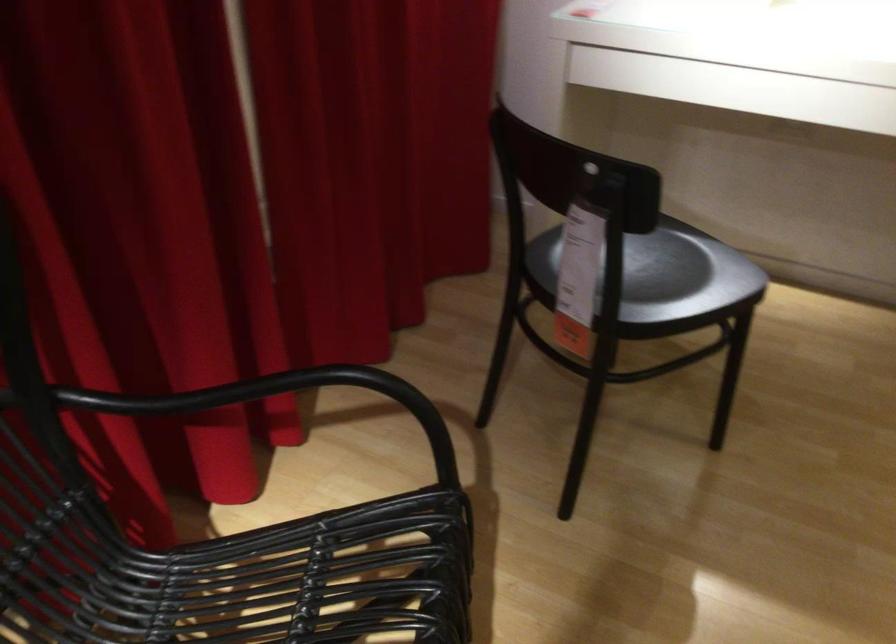
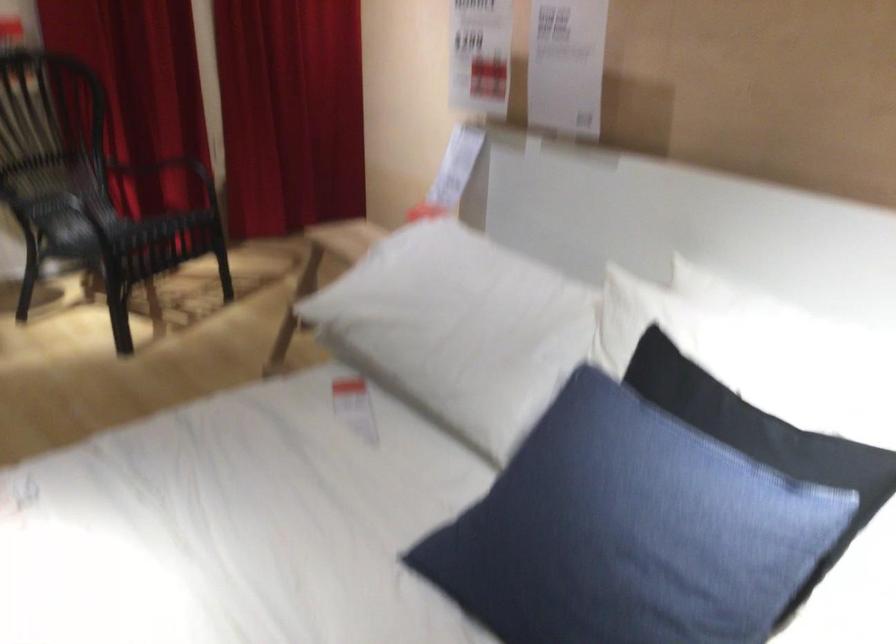
Find the pixel in the second image that matches point (209, 364) in the first image.

(176, 169)